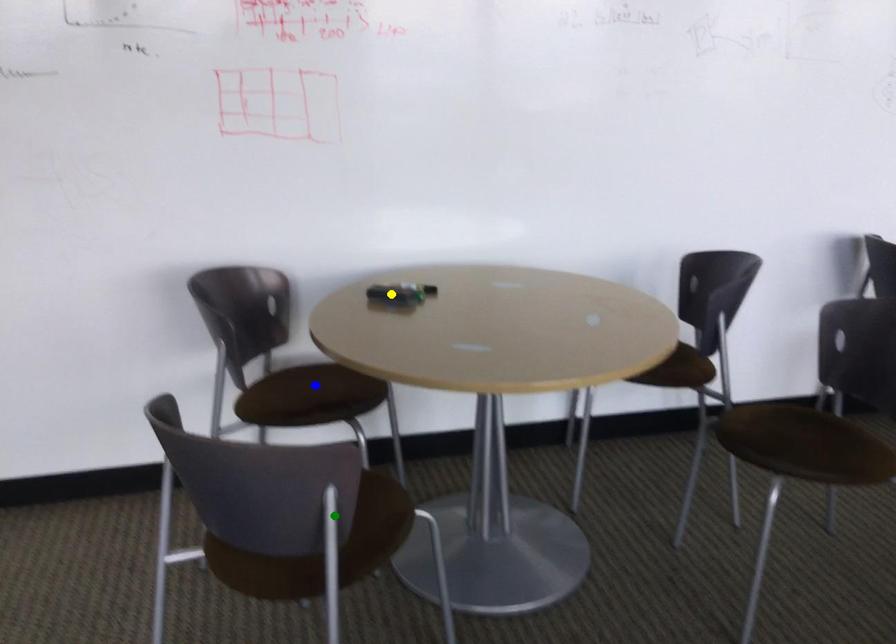
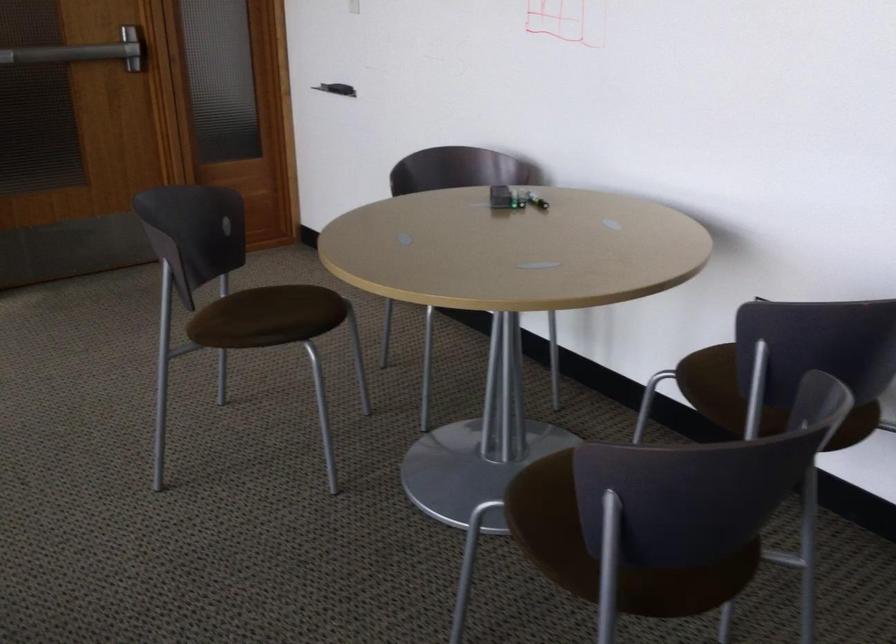
I am providing you with two images of the same scene from different viewpoints. Three points are marked in image1. Which point corresponds to a part or object that is occluded in image2?In image1, three points are marked. Which of them correspond to a part or object that is occluded in image2?Among the three points shown in image1, which one corresponds to a part or object that is no longer visible due to occlusion in image2?

blue point cannot be seen in image2.